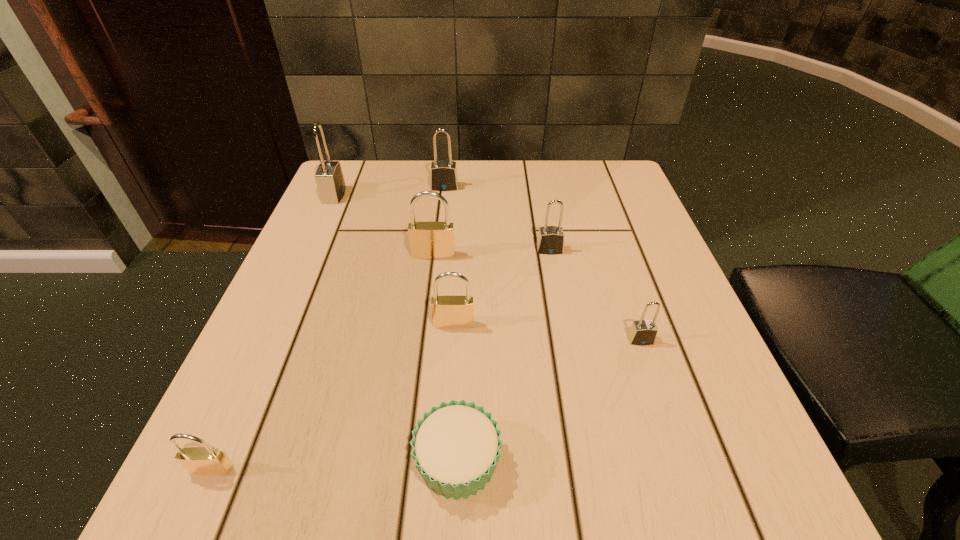
You are a GUI agent. You are given a task and a screenshot of the screen. Output one action in this format:
    pyautogui.click(x=<x>, y=<y>)
    Task: Click on the nearest padlock
    
    Given the screenshot: What is the action you would take?
    pyautogui.click(x=205, y=460)

In order to click on the smallest brass padlock in this screenshot , I will do `click(205, 460)`.

At what (x,y) coordinates should I click in order to perform the action: click on the shortest object. Please return your answer as a coordinate pair (x, y). The height and width of the screenshot is (540, 960). Looking at the image, I should click on (456, 447).

Find the location of a particular element. Image resolution: width=960 pixels, height=540 pixels. vacant space located 0.100m on the shackle of the leftmost gray padlock is located at coordinates (386, 195).

You are a GUI agent. You are given a task and a screenshot of the screen. Output one action in this format:
    pyautogui.click(x=<x>, y=<y>)
    Task: Click on the vacant space situated on the shackle of the second biggest gray padlock
    This screenshot has height=540, width=960.
    Given the screenshot: What is the action you would take?
    click(x=443, y=203)

This screenshot has height=540, width=960. Find the location of `free location located on the front-facing side of the biggest brass padlock`. free location located on the front-facing side of the biggest brass padlock is located at coordinates (425, 319).

Where is `vacant region located 0.140m on the shackle of the second gray padlock from right to left`? vacant region located 0.140m on the shackle of the second gray padlock from right to left is located at coordinates (560, 305).

This screenshot has width=960, height=540. Identify the location of free space located on the front-facing side of the second farthest brass padlock. (449, 408).

I want to click on vacant space located 0.210m on the shackle of the rightmost padlock, so click(x=686, y=474).

Find the location of a particular element. This screenshot has height=540, width=960. vacant area situated 0.340m on the back of the shortest object is located at coordinates [x=466, y=264].